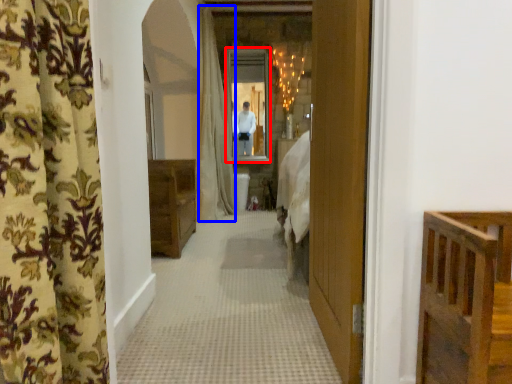
Question: Which point is closer to the camera, mirror (highlighted by a red box) or shower curtain (highlighted by a blue box)?

Choices:
 (A) mirror
 (B) shower curtain

Answer: (B)